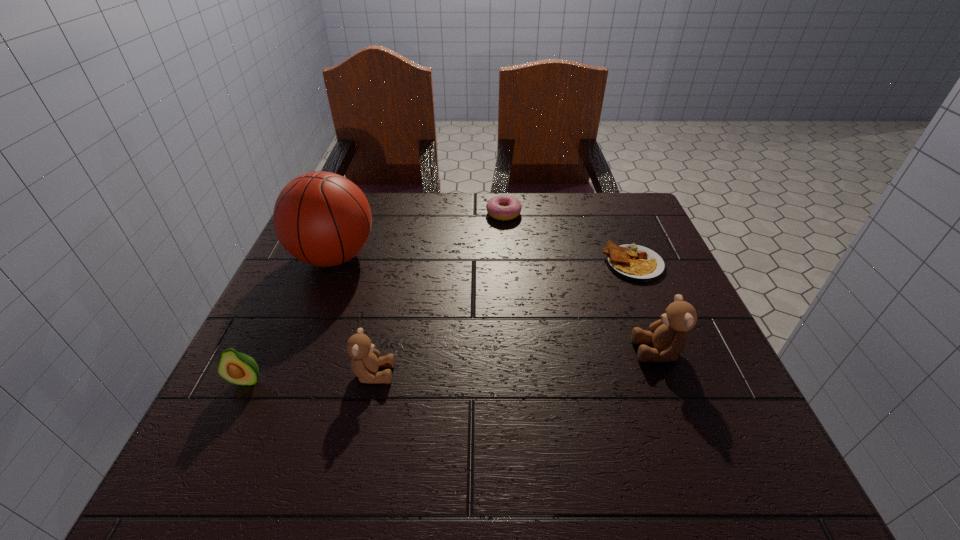
Locate an element on the screen. Image resolution: width=960 pixels, height=540 pixels. basketball situated at the left edge is located at coordinates (323, 219).

Find the location of a particular element. Image resolution: width=960 pixels, height=540 pixels. avocado situated at the left edge is located at coordinates (238, 368).

I want to click on teddy bear located at the right edge, so click(669, 335).

This screenshot has width=960, height=540. Find the location of `omelet that is at the right edge`. omelet that is at the right edge is located at coordinates (632, 262).

Where is `object that is at the far left corner`? Image resolution: width=960 pixels, height=540 pixels. object that is at the far left corner is located at coordinates (323, 219).

Where is `object present at the near left corner`? This screenshot has height=540, width=960. object present at the near left corner is located at coordinates (238, 368).

You are a GUI agent. You are given a task and a screenshot of the screen. Output one action in this format:
    pyautogui.click(x=<x>, y=<y>)
    Task: Click on the free space at the far edge
    Image resolution: width=960 pixels, height=540 pixels.
    Given the screenshot: What is the action you would take?
    pyautogui.click(x=455, y=206)

Where is `free space at the near edge of the desktop`? This screenshot has width=960, height=540. free space at the near edge of the desktop is located at coordinates (631, 388).

Find the location of a particular element. The image size is (960, 540). free region at the left edge is located at coordinates (300, 294).

The width and height of the screenshot is (960, 540). In the image, there is a desktop. In order to click on vacant area at the right edge in this screenshot , I will do `click(616, 282)`.